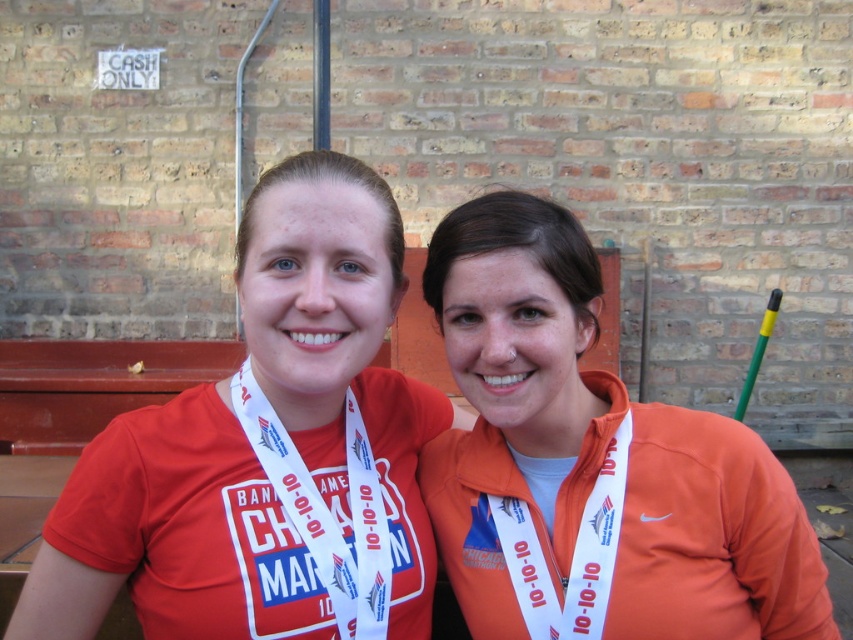
You are a photographer at the Chicago Marathon event. You need to focus your camera on the matte red shirt at center. According to the coordinates provided, where exactly should you aim your camera?

The matte red shirt at center is located at point (264, 454), so you should aim your camera at those coordinates to focus on it.

You are a photographer trying to capture a clear photo of both individuals. You notice two points of interest marked as point [572,449] and point [335,376]. Which point is closer to the camera so you can focus on it first?

Point [335,376] is closer to the camera than point [572,449], so focus on it first.